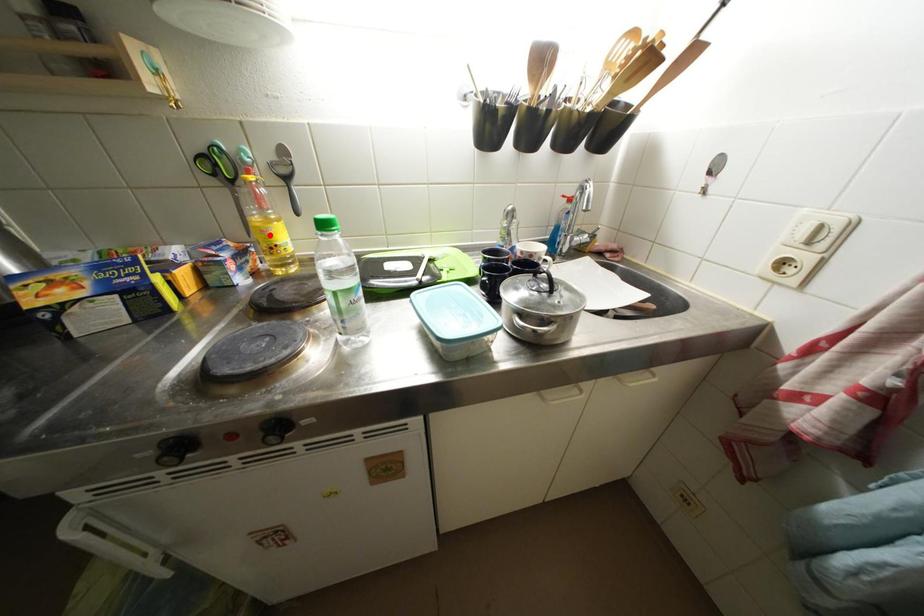
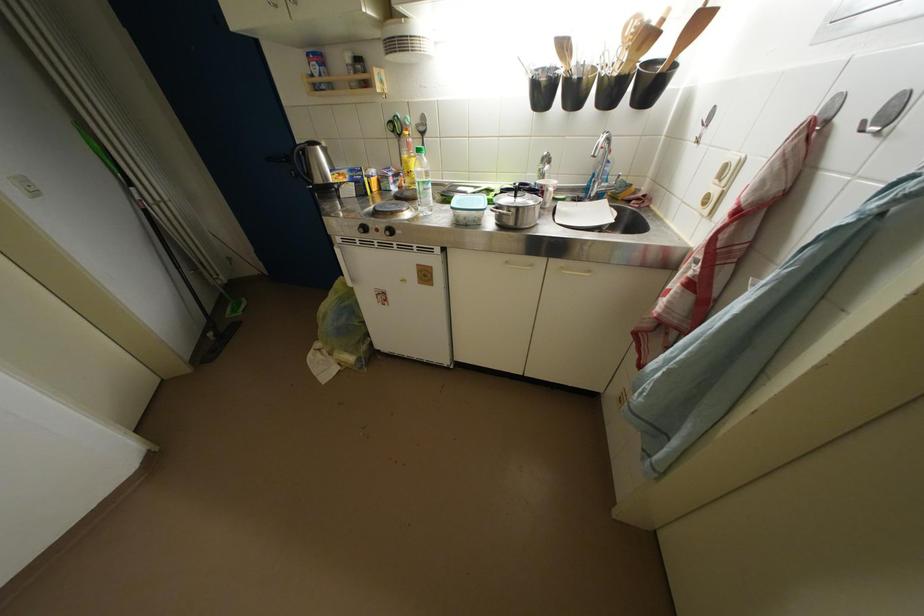
In the second image, find the point that corresponds to the highlighted location in the first image.

(412, 167)